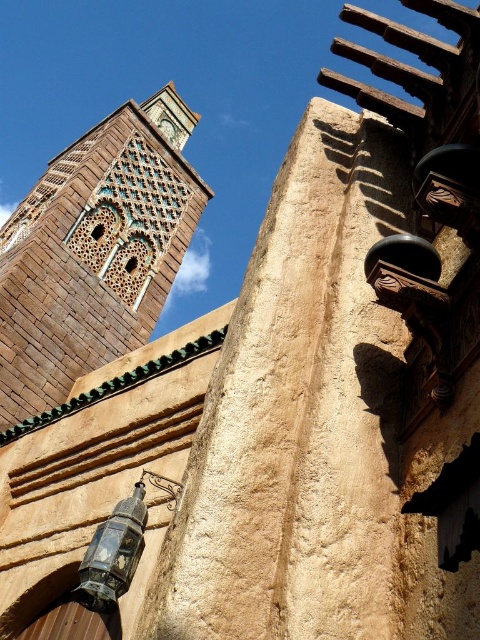
Consider the image. Measure the distance from brown textured stone tower at upper left to matte black lantern at lower left.

A distance of 43.79 meters exists between brown textured stone tower at upper left and matte black lantern at lower left.

Is point (169, 236) positioned after point (93, 573)?

Yes, point (169, 236) is farther from viewer.

Where is `brown textured stone tower at upper left`? Image resolution: width=480 pixels, height=640 pixels. brown textured stone tower at upper left is located at coordinates (94, 252).

Which of these two, matte black lantern at lower left or green stone clock at upper center, stands shorter?

Standing shorter between the two is green stone clock at upper center.

Can you confirm if matte black lantern at lower left is positioned below green stone clock at upper center?

Yes.

Measure the distance between point (99, 586) and camera.

Point (99, 586) and camera are 87.25 feet apart from each other.

Find the location of `matte black lantern at lower left`. matte black lantern at lower left is located at coordinates (119, 547).

Is point (144, 196) farther from camera compared to point (173, 124)?

No, (144, 196) is in front of (173, 124).

Who is more forward, (153, 131) or (164, 118)?

Point (153, 131) is more forward.

Where is `brown textured stone tower at upper left`? brown textured stone tower at upper left is located at coordinates (94, 252).